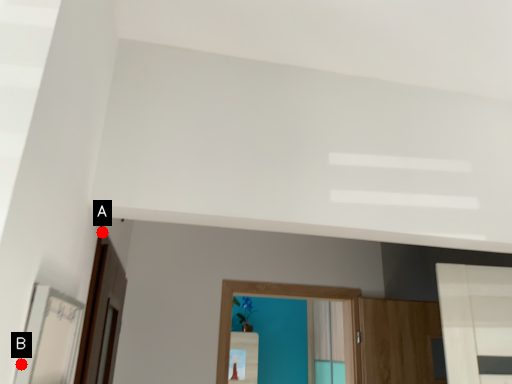
Question: Two points are circled on the image, labeled by A and B beside each circle. Among these points, which one is nearest to the camera?

Choices:
 (A) A is closer
 (B) B is closer

Answer: (B)